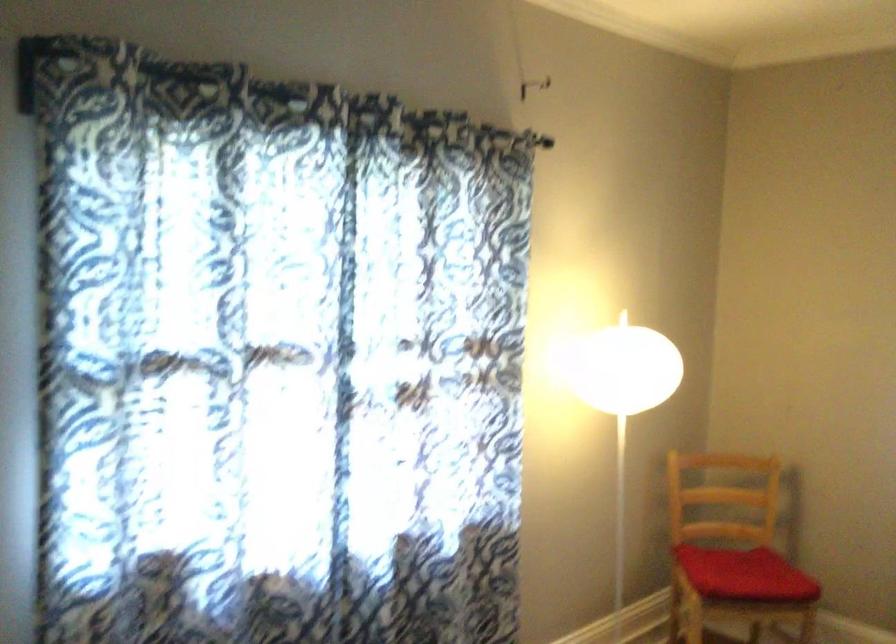
What do you see at coordinates (745, 574) in the screenshot? This screenshot has width=896, height=644. I see `the red chair sitting surface` at bounding box center [745, 574].